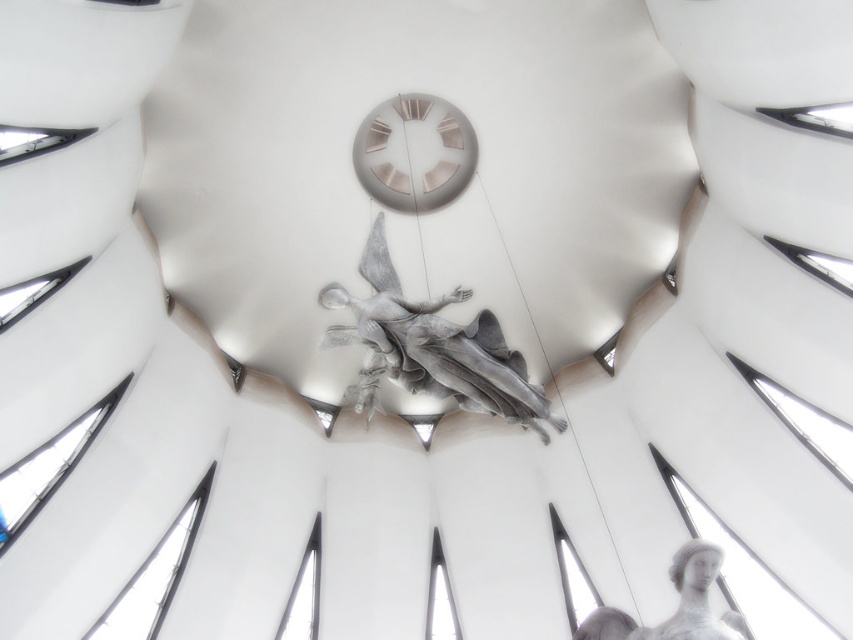
Question: Can you confirm if sculpted silver angel at center is positioned below metallic silver clock at center?

Choices:
 (A) no
 (B) yes

Answer: (B)

Question: Estimate the real-world distances between objects in this image. Which object is closer to the gray stone statue at lower right?

Choices:
 (A) metallic silver clock at center
 (B) sculpted silver angel at center

Answer: (B)

Question: Considering the real-world distances, which object is farthest from the sculpted silver angel at center?

Choices:
 (A) metallic silver clock at center
 (B) gray stone statue at lower right

Answer: (B)

Question: Is metallic silver clock at center positioned in front of gray stone statue at lower right?

Choices:
 (A) yes
 (B) no

Answer: (B)

Question: From the image, what is the correct spatial relationship of metallic silver clock at center in relation to gray stone statue at lower right?

Choices:
 (A) left
 (B) right

Answer: (A)

Question: Which object is positioned closest to the gray stone statue at lower right?

Choices:
 (A) metallic silver clock at center
 (B) sculpted silver angel at center

Answer: (B)